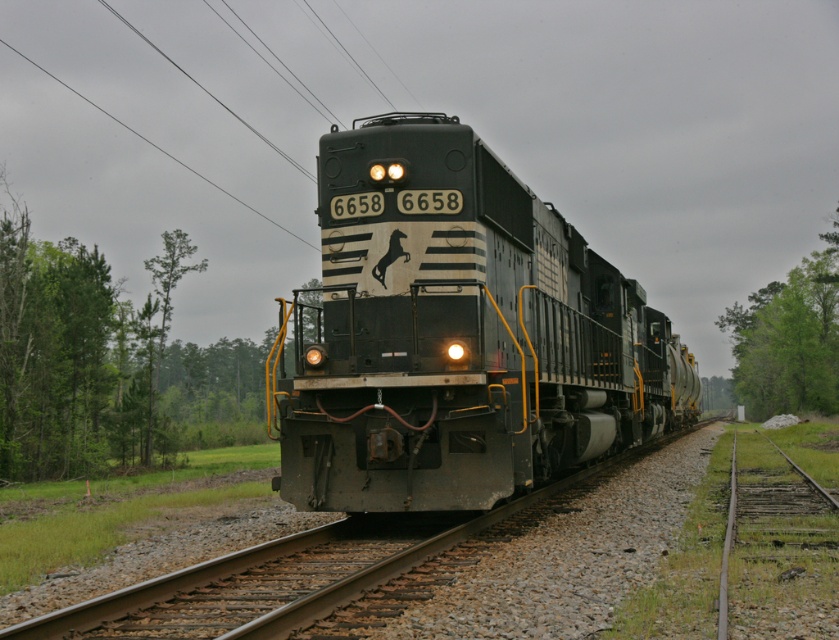
You are a photographer trying to capture the metallic locomotive at center and the green leafy tree at left in a single frame. Given that your camera has a fixed focal length, which object should you position closer to the center of the frame to ensure both are fully visible?

The metallic locomotive at center is narrower than the green leafy tree at left, so you should position the metallic locomotive at center closer to the center of the frame to ensure both are fully visible.

You are a passenger on the freight train and looking out the window. You notice two points marked on the window. The first point is at coordinates point (9,237) and the second is at point (831,356). Which point would you see first as the train moves forward?

Point (9,237) is in front of point (831,356), so you would see point (9,237) first as the train moves forward.